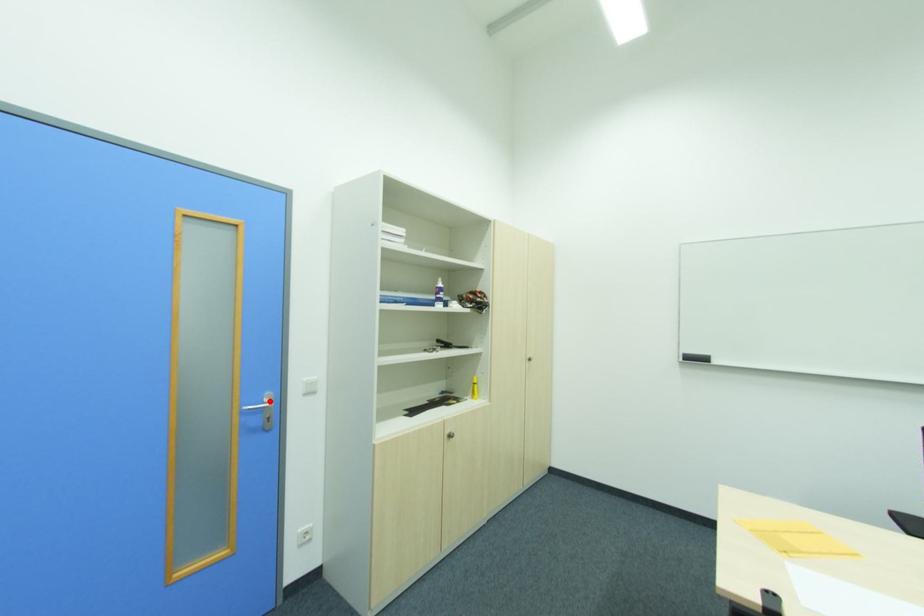
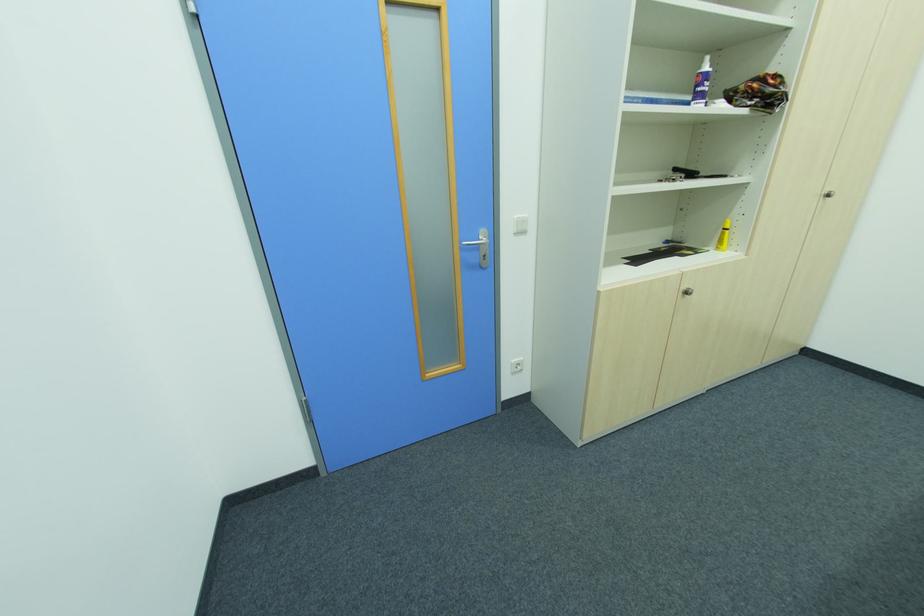
Find the pixel in the second image that matches the highlighted location in the first image.

(484, 238)